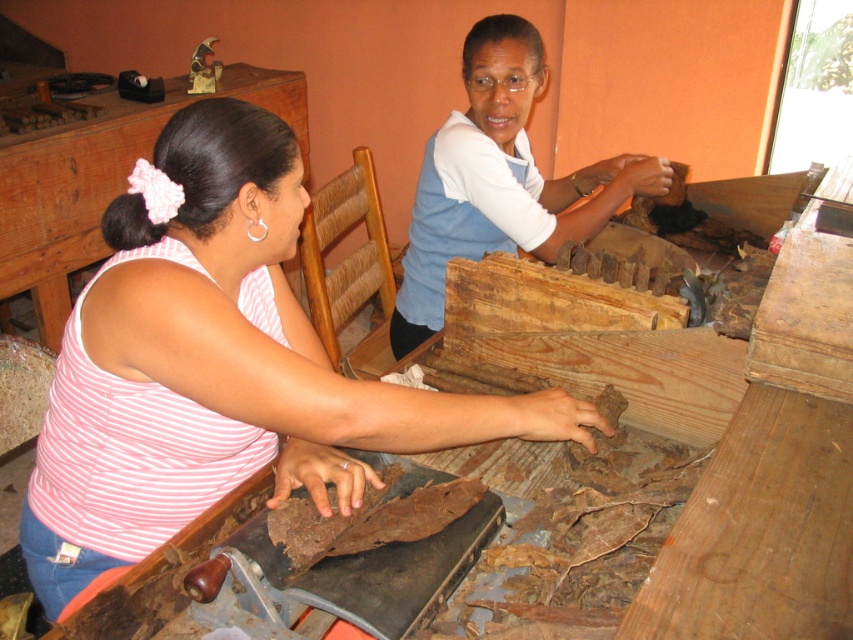
Question: Among these points, which one is farthest from the camera?

Choices:
 (A) (607, 195)
 (B) (416, 396)

Answer: (A)

Question: Is pink striped tank top at center wider than blue cotton shirt at upper center?

Choices:
 (A) no
 (B) yes

Answer: (B)

Question: Is pink striped tank top at center thinner than blue cotton shirt at upper center?

Choices:
 (A) yes
 (B) no

Answer: (B)

Question: Is pink striped tank top at center further to camera compared to blue cotton shirt at upper center?

Choices:
 (A) no
 (B) yes

Answer: (A)